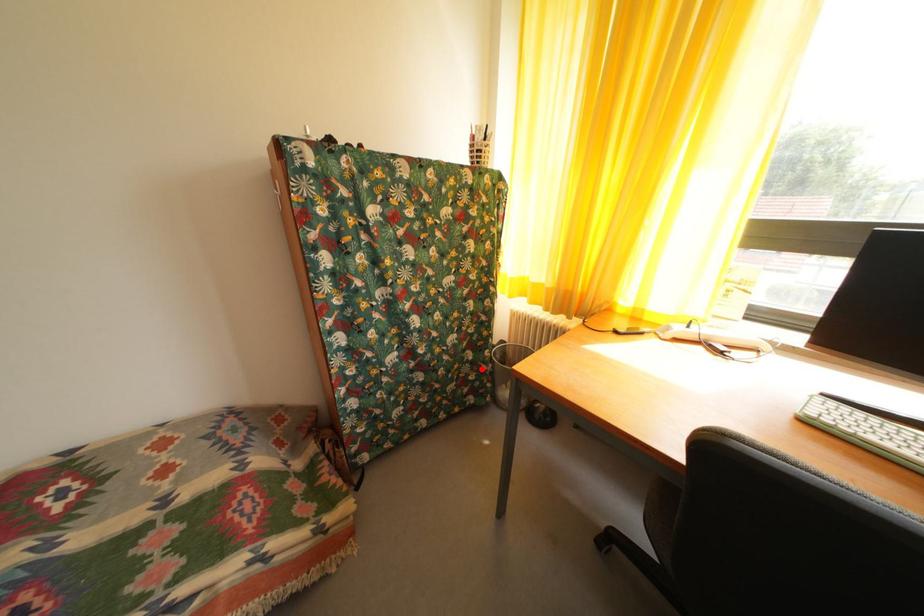
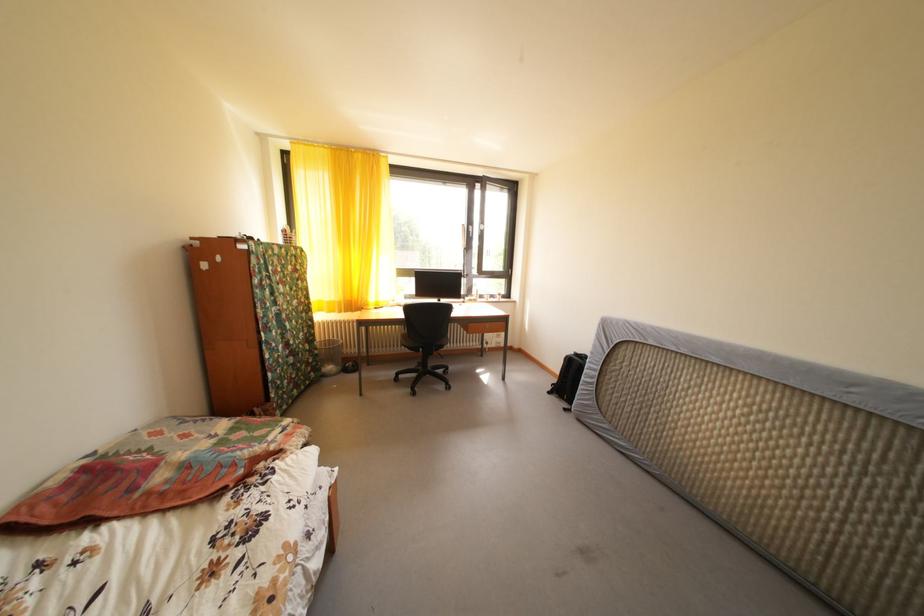
In the second image, find the point that corresponds to the highlighted location in the first image.

(320, 357)